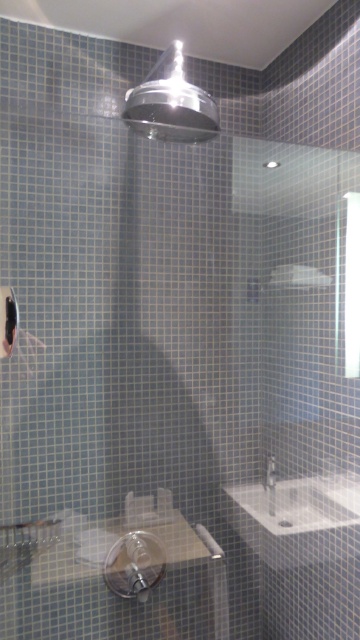
Does white glossy sink at lower right have a smaller size compared to white glossy faucet at lower right?

No, white glossy sink at lower right is not smaller than white glossy faucet at lower right.

Who is higher up, white glossy sink at lower right or white glossy faucet at lower right?

white glossy faucet at lower right

Who is more forward, (344, 490) or (271, 483)?

Point (344, 490) is more forward.

The width and height of the screenshot is (360, 640). Identify the location of white glossy sink at lower right. (300, 502).

Can you confirm if polished chrome shower head at upper center is thinner than white glossy faucet at lower right?

Incorrect, polished chrome shower head at upper center's width is not less than white glossy faucet at lower right's.

Does polished chrome shower head at upper center come in front of white glossy faucet at lower right?

Yes, polished chrome shower head at upper center is closer to the viewer.

The width and height of the screenshot is (360, 640). Describe the element at coordinates (171, 104) in the screenshot. I see `polished chrome shower head at upper center` at that location.

The width and height of the screenshot is (360, 640). Identify the location of polished chrome shower head at upper center. (171, 104).

Is white glossy sink at lower right bigger than polished chrome shower head at upper center?

Actually, white glossy sink at lower right might be smaller than polished chrome shower head at upper center.

Does white glossy sink at lower right appear under polished chrome shower head at upper center?

Yes.

Does point (329, 513) come in front of point (174, 80)?

No, (329, 513) is further to viewer.

The height and width of the screenshot is (640, 360). Identify the location of white glossy sink at lower right. (300, 502).